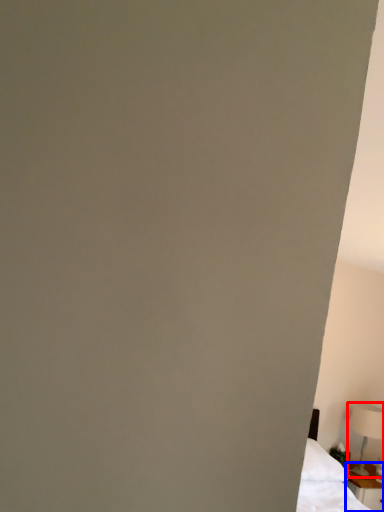
Question: Which point is further to the camera, table lamp (highlighted by a red box) or nightstand (highlighted by a blue box)?

Choices:
 (A) table lamp
 (B) nightstand

Answer: (A)